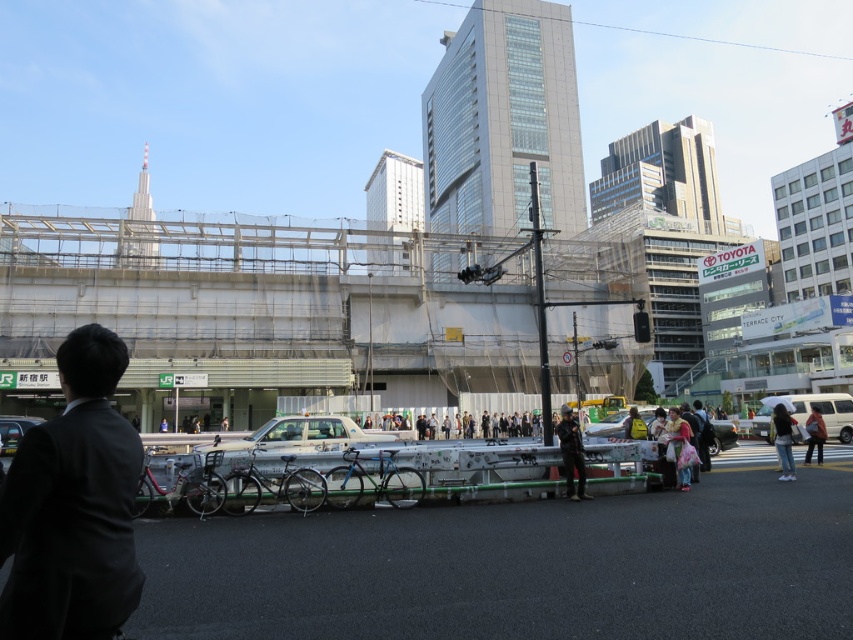
Is white glossy taxi at center below shiny black car at lower left?

Correct, white glossy taxi at center is located below shiny black car at lower left.

Between point (305, 445) and point (15, 433), which one is positioned in front?

Point (305, 445)

Where is `white glossy taxi at center`? The image size is (853, 640). white glossy taxi at center is located at coordinates (294, 436).

Is point (680, 435) closer to camera compared to point (814, 444)?

Yes, point (680, 435) is in front of point (814, 444).

I want to click on light pink fabric bag at lower right, so click(679, 448).

Can you confirm if white glossy taxi at center is bigger than metallic silver car at center?

Yes, white glossy taxi at center is bigger than metallic silver car at center.

Looking at this image, who is lower down, white glossy taxi at center or metallic silver car at center?

white glossy taxi at center

Locate an element on the screen. This screenshot has height=640, width=853. white glossy taxi at center is located at coordinates (294, 436).

Locate an element on the screen. white glossy taxi at center is located at coordinates (294, 436).